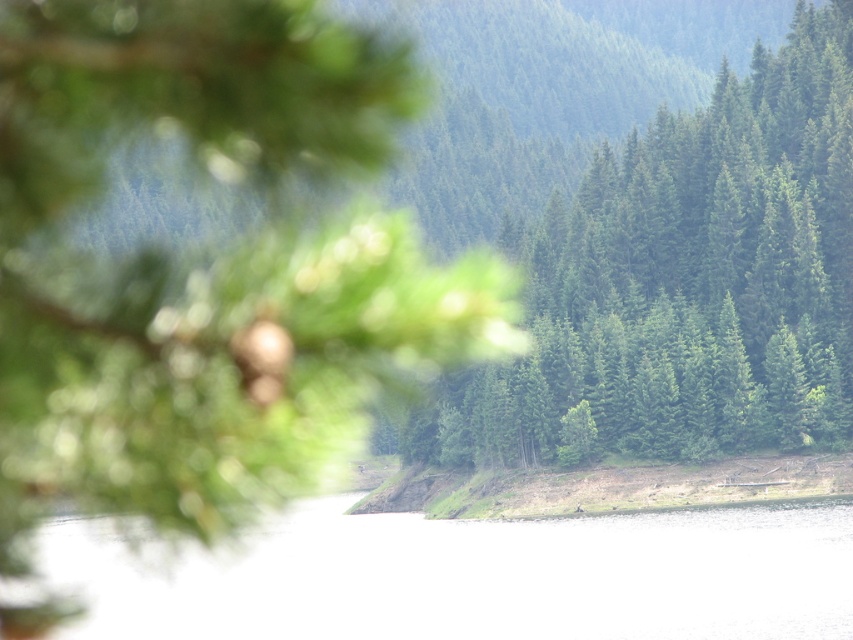
Question: Can you confirm if green matte tree at center is positioned below clear water at center?

Choices:
 (A) yes
 (B) no

Answer: (B)

Question: Which object is farther from the camera taking this photo?

Choices:
 (A) clear water at center
 (B) green matte tree at center

Answer: (B)

Question: Which object is farther from the camera taking this photo?

Choices:
 (A) green matte tree at center
 (B) clear water at center

Answer: (A)

Question: In this image, where is green matte tree at center located relative to clear water at center?

Choices:
 (A) below
 (B) above

Answer: (B)

Question: Does green matte tree at center have a smaller size compared to clear water at center?

Choices:
 (A) yes
 (B) no

Answer: (B)